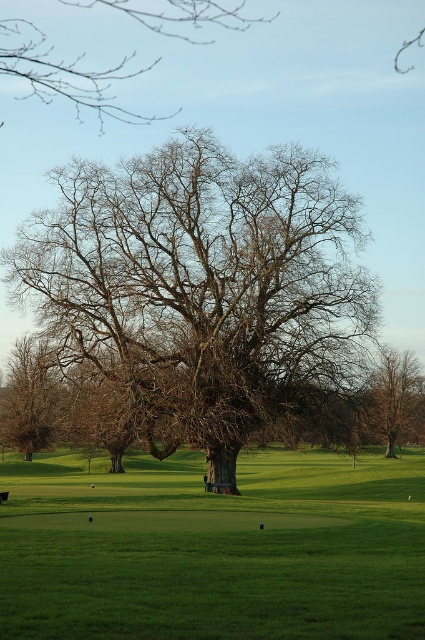
Question: Which of the following is the closest to the observer?

Choices:
 (A) (6, 394)
 (B) (8, 576)
 (C) (405, 396)

Answer: (B)

Question: Can you confirm if green grass at center is positioned below brown/dry bark tree at left?

Choices:
 (A) no
 (B) yes

Answer: (B)

Question: Which is nearer to the brown/dry bark tree at left?

Choices:
 (A) bare wood oak tree at center
 (B) green grass at center
 (C) bare branches at upper left
 (D) brown leafless tree at right

Answer: (B)

Question: From the image, what is the correct spatial relationship of bare branches at upper left in relation to brown leafless tree at right?

Choices:
 (A) right
 (B) left

Answer: (B)

Question: Considering the relative positions of bare wood oak tree at center and green grass at center in the image provided, where is bare wood oak tree at center located with respect to green grass at center?

Choices:
 (A) left
 (B) right

Answer: (A)

Question: Among these objects, which one is nearest to the camera?

Choices:
 (A) green grass at center
 (B) bare wood oak tree at center
 (C) bare branches at upper left

Answer: (A)